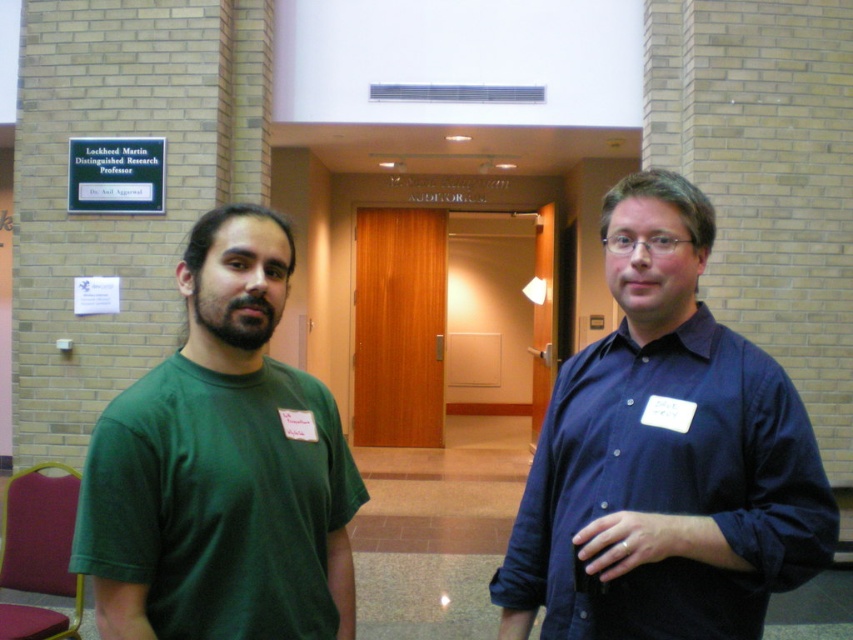
Question: Is green matte t-shirt at left behind dark blue button-up shirt at right?

Choices:
 (A) yes
 (B) no

Answer: (B)

Question: Does green matte t-shirt at left appear over dark blue button-up shirt at right?

Choices:
 (A) yes
 (B) no

Answer: (A)

Question: Where is green matte t-shirt at left located in relation to dark blue button-up shirt at right in the image?

Choices:
 (A) left
 (B) right

Answer: (A)

Question: Which point appears farthest from the camera in this image?

Choices:
 (A) 631,371
 (B) 190,348

Answer: (A)

Question: Which of the following is the farthest from the observer?

Choices:
 (A) (322, 552)
 (B) (665, 417)

Answer: (A)